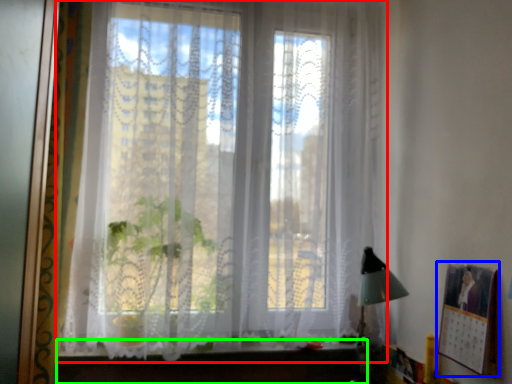
Question: Which object is positioned farthest from window (highlighted by a red box)? Select from picture frame (highlighted by a blue box) and vanity (highlighted by a green box).

Choices:
 (A) picture frame
 (B) vanity

Answer: (A)